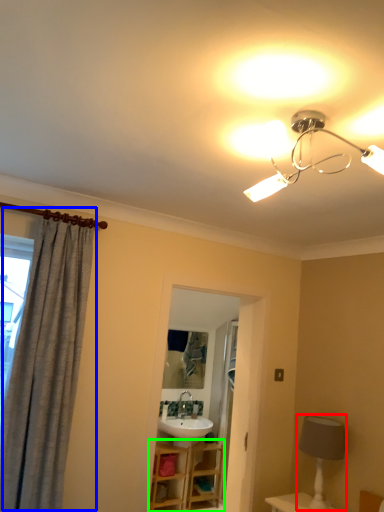
Question: Considering the real-world distances, which object is closest to table lamp (highlighted by a red box)? curtain (highlighted by a blue box) or vanity (highlighted by a green box).

Choices:
 (A) curtain
 (B) vanity

Answer: (A)